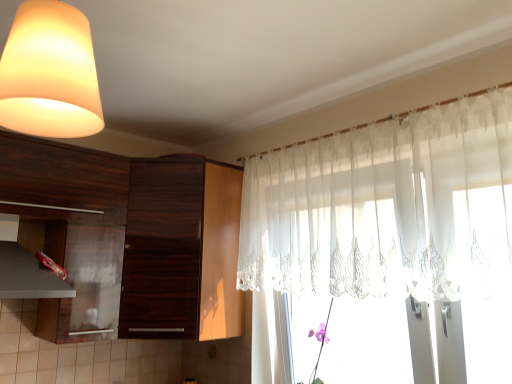
What is the approximate width of sheer white curtain at upper right?

sheer white curtain at upper right is 5.04 inches wide.

Measure the distance between point [77,313] and camera.

They are 6.76 feet apart.

Identify the location of dark wood cabinet at center, placed as the second cabinetry when sorted from left to right. (181, 251).

Can you confirm if dark wood cabinet at left, the first cabinetry positioned from the left, is bigger than matte white lampshade at upper left?

Yes, dark wood cabinet at left, the first cabinetry positioned from the left, is bigger than matte white lampshade at upper left.

Is dark wood cabinet at left, which ranks as the second cabinetry in right-to-left order, looking in the opposite direction of matte white lampshade at upper left?

dark wood cabinet at left, which ranks as the second cabinetry in right-to-left order, does not have its back to matte white lampshade at upper left.

What's the angular difference between dark wood cabinet at left, which ranks as the second cabinetry in right-to-left order, and matte white lampshade at upper left's facing directions?

171 degrees separate the facing orientations of dark wood cabinet at left, which ranks as the second cabinetry in right-to-left order, and matte white lampshade at upper left.

In the scene shown: Does matte white lampshade at upper left appear on the right side of dark wood cabinet at center, which appears as the first cabinetry when viewed from the right?

Correct, you'll find matte white lampshade at upper left to the right of dark wood cabinet at center, which appears as the first cabinetry when viewed from the right.

Is matte white lampshade at upper left situated inside dark wood cabinet at center, which appears as the first cabinetry when viewed from the right, or outside?

matte white lampshade at upper left is not enclosed by dark wood cabinet at center, which appears as the first cabinetry when viewed from the right.

Between matte white lampshade at upper left and dark wood cabinet at center, which appears as the first cabinetry when viewed from the right, which one is positioned behind?

dark wood cabinet at center, which appears as the first cabinetry when viewed from the right, is further away from the camera.

Could you tell me if dark wood cabinet at left, the first cabinetry positioned from the left, is turned towards sheer white curtain at upper right?

No, dark wood cabinet at left, the first cabinetry positioned from the left, is not oriented towards sheer white curtain at upper right.

Choose the correct answer: Is dark wood cabinet at left, the first cabinetry positioned from the left, inside sheer white curtain at upper right or outside it?

dark wood cabinet at left, the first cabinetry positioned from the left, is outside sheer white curtain at upper right.

Considering the relative sizes of dark wood cabinet at left, the first cabinetry positioned from the left, and sheer white curtain at upper right in the image provided, is dark wood cabinet at left, the first cabinetry positioned from the left, bigger than sheer white curtain at upper right?

Yes.

From the image's perspective, is sheer white curtain at upper right located beneath dark wood cabinet at left, the first cabinetry positioned from the left?

Actually, sheer white curtain at upper right appears above dark wood cabinet at left, the first cabinetry positioned from the left, in the image.

Is point (302, 170) less distant than point (153, 270)?

Yes.

Based on their sizes in the image, would you say sheer white curtain at upper right is bigger or smaller than dark wood cabinet at left, the first cabinetry positioned from the left?

sheer white curtain at upper right is smaller than dark wood cabinet at left, the first cabinetry positioned from the left.

Considering their positions, is sheer white curtain at upper right located in front of or behind dark wood cabinet at left, which ranks as the second cabinetry in right-to-left order?

sheer white curtain at upper right is in front of dark wood cabinet at left, which ranks as the second cabinetry in right-to-left order.

Is the depth of matte black exhaust hood at lower left less than that of matte white lampshade at upper left?

No, it is not.

Considering the relative sizes of matte black exhaust hood at lower left and matte white lampshade at upper left in the image provided, is matte black exhaust hood at lower left smaller than matte white lampshade at upper left?

Actually, matte black exhaust hood at lower left might be larger than matte white lampshade at upper left.

Between point (26, 285) and point (64, 102), which one is positioned in front?

Positioned in front is point (64, 102).

Is matte black exhaust hood at lower left inside or outside of matte white lampshade at upper left?

matte black exhaust hood at lower left is spatially situated outside matte white lampshade at upper left.

How many degrees apart are the facing directions of dark wood cabinet at center, which appears as the first cabinetry when viewed from the right, and sheer white curtain at upper right?

There is a 90.4-degree angle between the facing directions of dark wood cabinet at center, which appears as the first cabinetry when viewed from the right, and sheer white curtain at upper right.

Between dark wood cabinet at center, which appears as the first cabinetry when viewed from the right, and sheer white curtain at upper right, which one has more height?

dark wood cabinet at center, which appears as the first cabinetry when viewed from the right.

Could you measure the distance between dark wood cabinet at center, which appears as the first cabinetry when viewed from the right, and sheer white curtain at upper right?

dark wood cabinet at center, which appears as the first cabinetry when viewed from the right, is 24.87 inches away from sheer white curtain at upper right.

Considering the points (194, 231) and (490, 138), which point is behind, point (194, 231) or point (490, 138)?

The point (194, 231) is behind.

Does dark wood cabinet at left, which ranks as the second cabinetry in right-to-left order, have a larger size compared to matte black exhaust hood at lower left?

Yes, dark wood cabinet at left, which ranks as the second cabinetry in right-to-left order, is bigger than matte black exhaust hood at lower left.

Is there a large distance between dark wood cabinet at left, the first cabinetry positioned from the left, and matte black exhaust hood at lower left?

dark wood cabinet at left, the first cabinetry positioned from the left, is actually quite close to matte black exhaust hood at lower left.

Could you tell me if dark wood cabinet at left, the first cabinetry positioned from the left, is turned towards matte black exhaust hood at lower left?

Yes.

Considering the positions of points (44, 327) and (24, 270), is point (44, 327) closer to camera compared to point (24, 270)?

No.

Locate an element on the screen. This screenshot has width=512, height=384. lamp in front of the dark wood cabinet at left, which ranks as the second cabinetry in right-to-left order is located at coordinates (50, 73).

Locate an element on the screen. The width and height of the screenshot is (512, 384). lamp located above the dark wood cabinet at center, which appears as the first cabinetry when viewed from the right (from the image's perspective) is located at coordinates coord(50,73).

When comparing their distances from dark wood cabinet at center, which appears as the first cabinetry when viewed from the right, does sheer white curtain at upper right or dark wood cabinet at left, which ranks as the second cabinetry in right-to-left order, seem further?

Based on the image, sheer white curtain at upper right appears to be further to dark wood cabinet at center, which appears as the first cabinetry when viewed from the right.

Which object lies further to the anchor point dark wood cabinet at left, which ranks as the second cabinetry in right-to-left order, dark wood cabinet at center, placed as the second cabinetry when sorted from left to right, or matte black exhaust hood at lower left?

matte black exhaust hood at lower left is further to dark wood cabinet at left, which ranks as the second cabinetry in right-to-left order.

Considering their positions, is dark wood cabinet at center, which appears as the first cabinetry when viewed from the right, positioned closer to matte black exhaust hood at lower left than matte white lampshade at upper left?

The object closer to matte black exhaust hood at lower left is dark wood cabinet at center, which appears as the first cabinetry when viewed from the right.

Looking at the image, which one is located closer to sheer white curtain at upper right, dark wood cabinet at left, the first cabinetry positioned from the left, or matte white lampshade at upper left?

dark wood cabinet at left, the first cabinetry positioned from the left, lies closer to sheer white curtain at upper right than the other object.

From the image, which object appears to be farther from matte black exhaust hood at lower left, sheer white curtain at upper right or matte white lampshade at upper left?

The object further to matte black exhaust hood at lower left is sheer white curtain at upper right.

From the image, which object appears to be nearer to matte black exhaust hood at lower left, sheer white curtain at upper right or dark wood cabinet at left, the first cabinetry positioned from the left?

dark wood cabinet at left, the first cabinetry positioned from the left, lies closer to matte black exhaust hood at lower left than the other object.

Considering their positions, is dark wood cabinet at center, placed as the second cabinetry when sorted from left to right, positioned further to sheer white curtain at upper right than dark wood cabinet at left, which ranks as the second cabinetry in right-to-left order?

dark wood cabinet at left, which ranks as the second cabinetry in right-to-left order, lies further to sheer white curtain at upper right than the other object.

Estimate the real-world distances between objects in this image. Which object is further from sheer white curtain at upper right, dark wood cabinet at center, which appears as the first cabinetry when viewed from the right, or matte black exhaust hood at lower left?

matte black exhaust hood at lower left is further to sheer white curtain at upper right.

Where is `cabinetry between matte black exhaust hood at lower left and dark wood cabinet at center, which appears as the first cabinetry when viewed from the right`? The width and height of the screenshot is (512, 384). cabinetry between matte black exhaust hood at lower left and dark wood cabinet at center, which appears as the first cabinetry when viewed from the right is located at coordinates (129, 240).

The width and height of the screenshot is (512, 384). What are the coordinates of `exhaust hood between matte white lampshade at upper left and dark wood cabinet at left, which ranks as the second cabinetry in right-to-left order, from front to back` in the screenshot? It's located at (28, 276).

The height and width of the screenshot is (384, 512). I want to click on cabinetry positioned between matte white lampshade at upper left and dark wood cabinet at center, which appears as the first cabinetry when viewed from the right, from near to far, so click(x=129, y=240).

Image resolution: width=512 pixels, height=384 pixels. In order to click on lamp situated between dark wood cabinet at left, which ranks as the second cabinetry in right-to-left order, and sheer white curtain at upper right from left to right in this screenshot , I will do `click(50, 73)`.